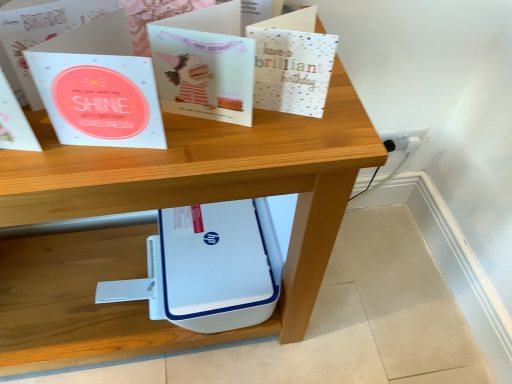
I want to click on free location to the right of metallic silver card at upper center, which is the third paperback book in left-to-right order, so click(x=344, y=122).